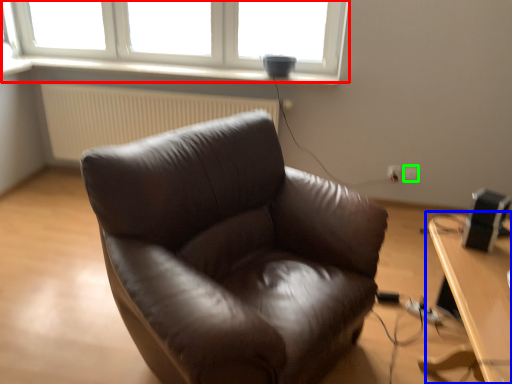
Question: Based on their relative distances, which object is nearer to window (highlighted by a red box)? Choose from table (highlighted by a blue box) and electric outlet (highlighted by a green box).

Choices:
 (A) table
 (B) electric outlet

Answer: (B)